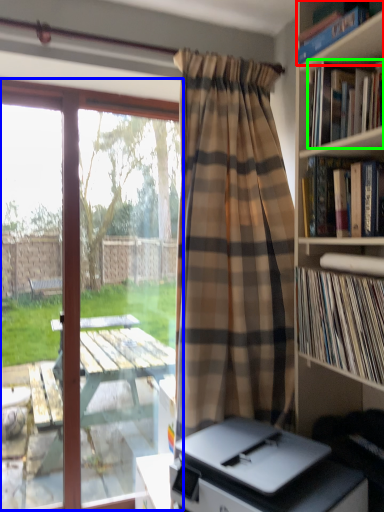
Question: Considering the real-world distances, which object is farthest from book (highlighted by a red box)? window (highlighted by a blue box) or book (highlighted by a green box)?

Choices:
 (A) window
 (B) book

Answer: (A)